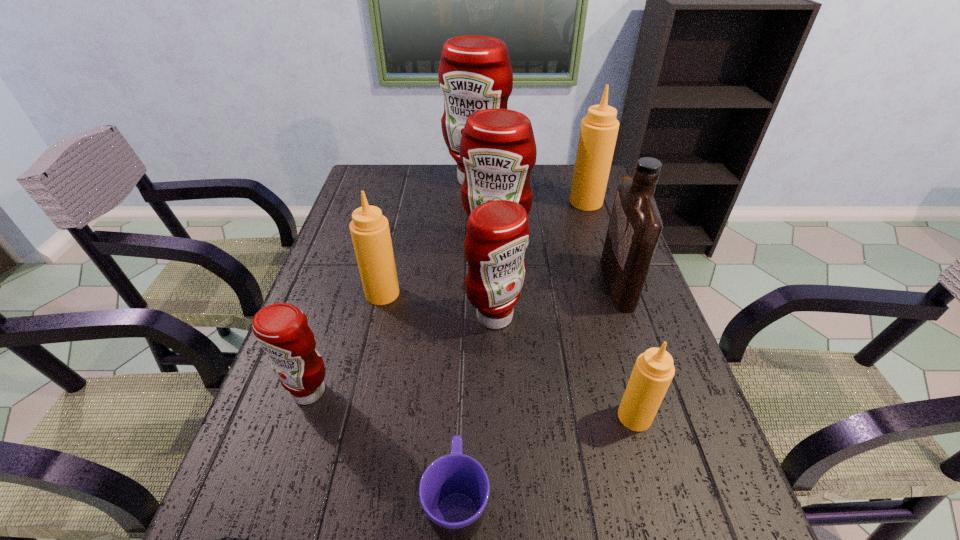
Where is `free region located 0.090m on the right of the smallest tan condiment`? The height and width of the screenshot is (540, 960). free region located 0.090m on the right of the smallest tan condiment is located at coordinates (697, 416).

Where is `vacant area situated 0.190m on the front of the smallest red condiment`? This screenshot has width=960, height=540. vacant area situated 0.190m on the front of the smallest red condiment is located at coordinates (270, 512).

Identify the location of liquor that is at the right edge. The height and width of the screenshot is (540, 960). [x=635, y=225].

Where is `object at the far right corner`? object at the far right corner is located at coordinates (598, 132).

Identify the location of vacant point at the left edge. (223, 526).

You are a GUI agent. You are given a task and a screenshot of the screen. Output one action in this format:
    pyautogui.click(x=<x>, y=<y>)
    Task: Click on the vacant region at the right edge of the desktop
    The height and width of the screenshot is (540, 960).
    Given the screenshot: What is the action you would take?
    pyautogui.click(x=673, y=430)

Identify the location of vacant region at the far right corner of the desktop. This screenshot has height=540, width=960. (566, 172).

Identify the location of free area in between the smallest tan condiment and the third farthest red condiment. This screenshot has width=960, height=540. (564, 367).

I want to click on free space that is in between the biggest red condiment and the liquor, so click(546, 232).

Identify the location of empty space that is in between the liquor and the nearest tan condiment. (626, 350).